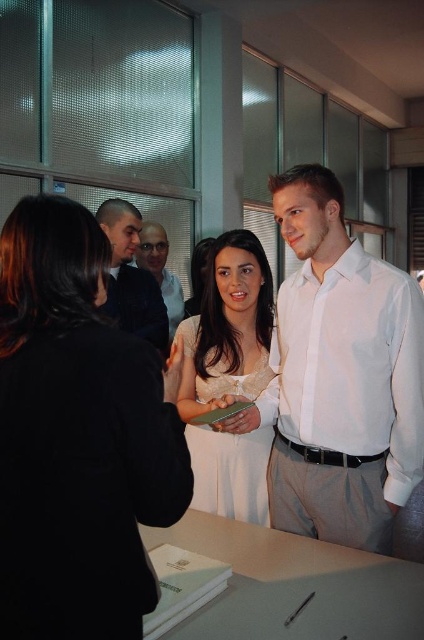
You are organizing a photo shoot and need to arrange two white satin items in the scene. The items are the white satin dress at center and the white satin shirt at upper right. Based on their sizes, which item should be placed closer to the camera to ensure both appear proportionally balanced in the final image?

The white satin dress at center is smaller in size compared to the white satin shirt at upper right. To achieve proportional balance, the smaller white satin dress at center should be placed closer to the camera while the larger white satin shirt at upper right can be positioned slightly farther back. This way, their sizes in the photograph will appear more balanced.

You are organizing a charity event and need to ensure that all donated clothing items fit into a display case. The display case has a maximum capacity for items up to the size of the matte black shirt at center. Can the dark blue suit at center be placed inside the display case?

The dark blue suit at center is larger in size than the matte black shirt at center, so it cannot be placed inside the display case as it exceeds the maximum capacity.

You are standing in the room and want to move from the point at coordinates point (47, 253) to the point at coordinates point (325, 289). Which direction should you move in to get closer to the second point?

To move from point (47, 253) to point (325, 289), you should move upward and to the right since point (325, 289) is located above and to the right of point (47, 253).